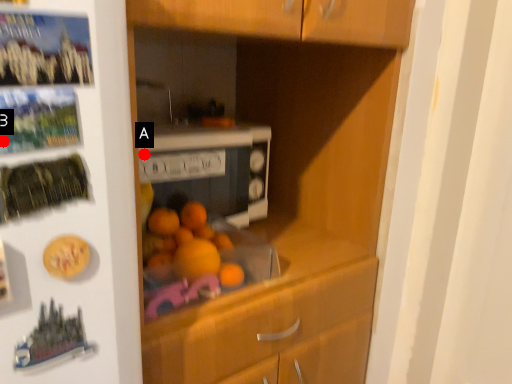
Question: Two points are circled on the image, labeled by A and B beside each circle. Which point is closer to the camera taking this photo?

Choices:
 (A) A is closer
 (B) B is closer

Answer: (B)